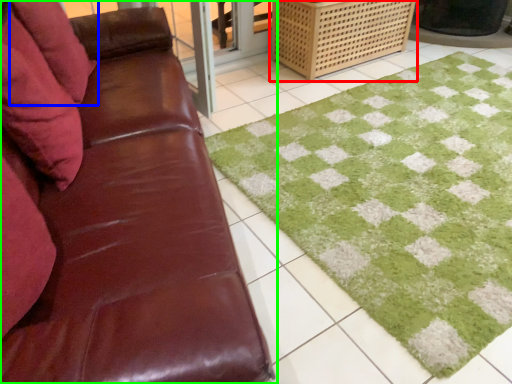
Question: Estimate the real-world distances between objects in this image. Which object is farther from crate (highlighted by a red box), pillow (highlighted by a blue box) or studio couch (highlighted by a green box)?

Choices:
 (A) pillow
 (B) studio couch

Answer: (B)